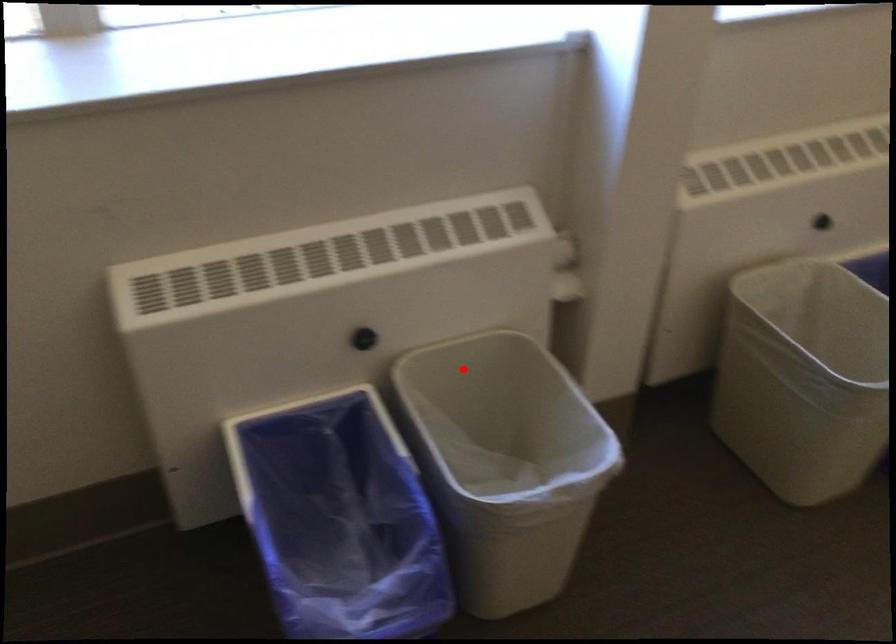
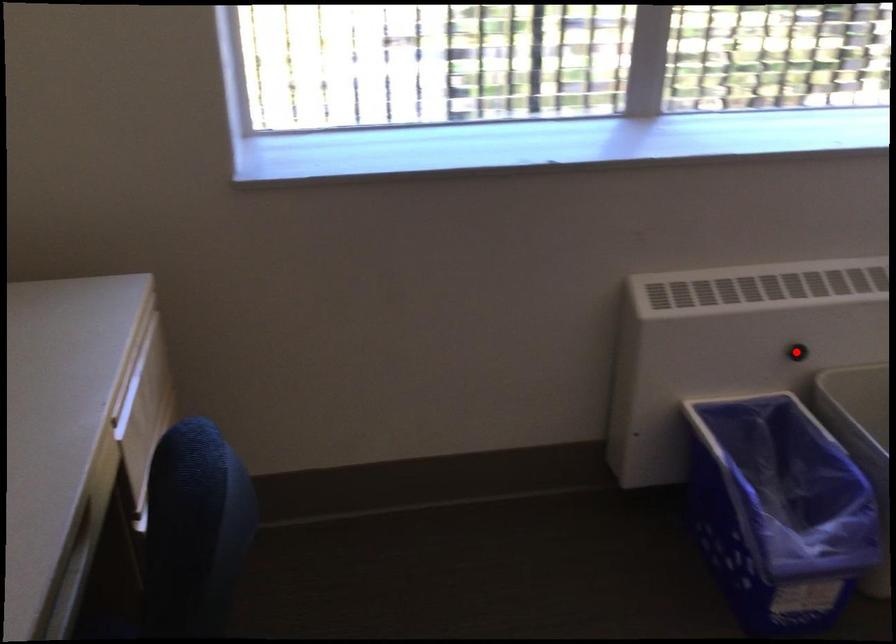
I am providing you with two images of the same scene from different viewpoints. A red point is marked on the first image and another point is marked on the second image. Do the highlighted points in image1 and image2 indicate the same real-world spot?

No